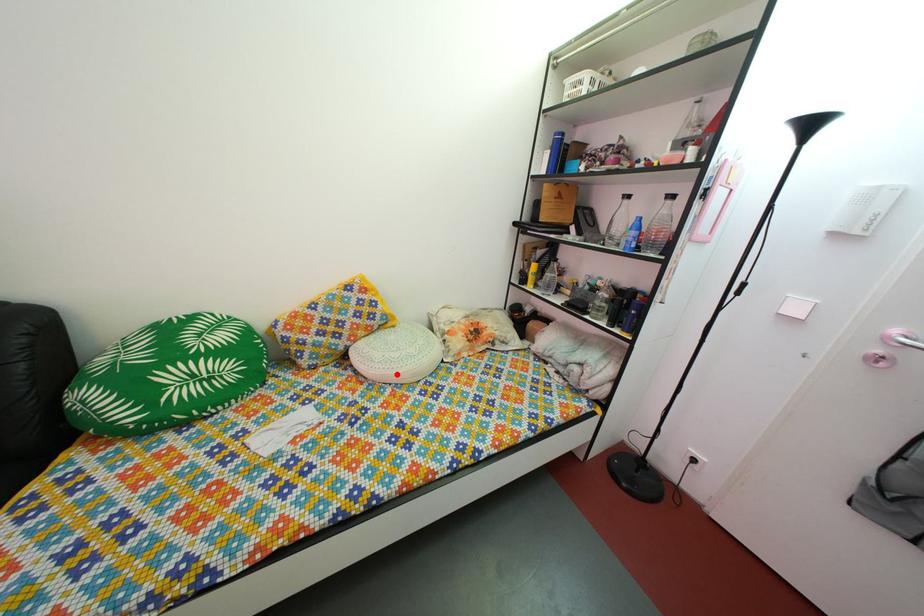
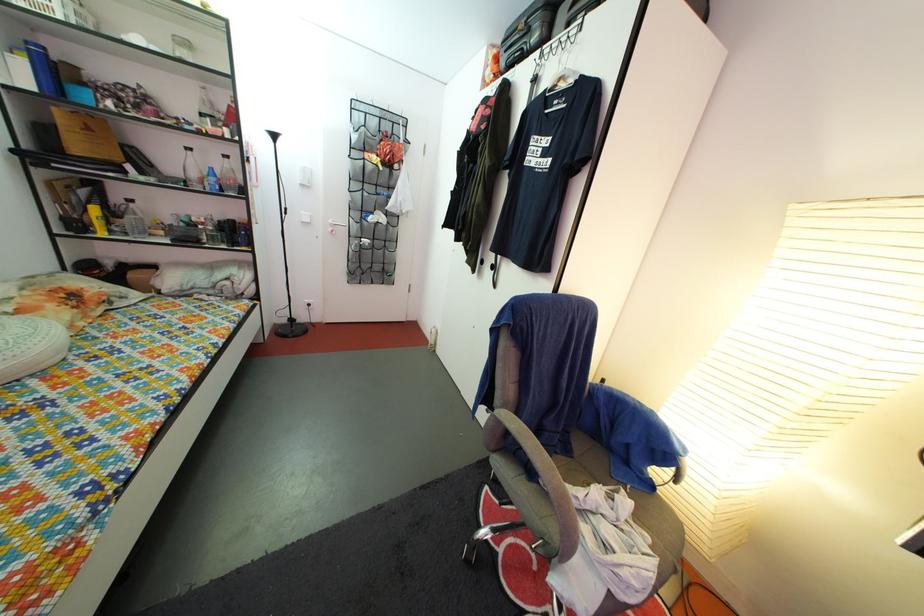
Question: I am providing you with two images of the same scene from different viewpoints. A red point is marked on the first image. Is the red point's position out of view in image 2?

Choices:
 (A) Yes
 (B) No

Answer: (B)